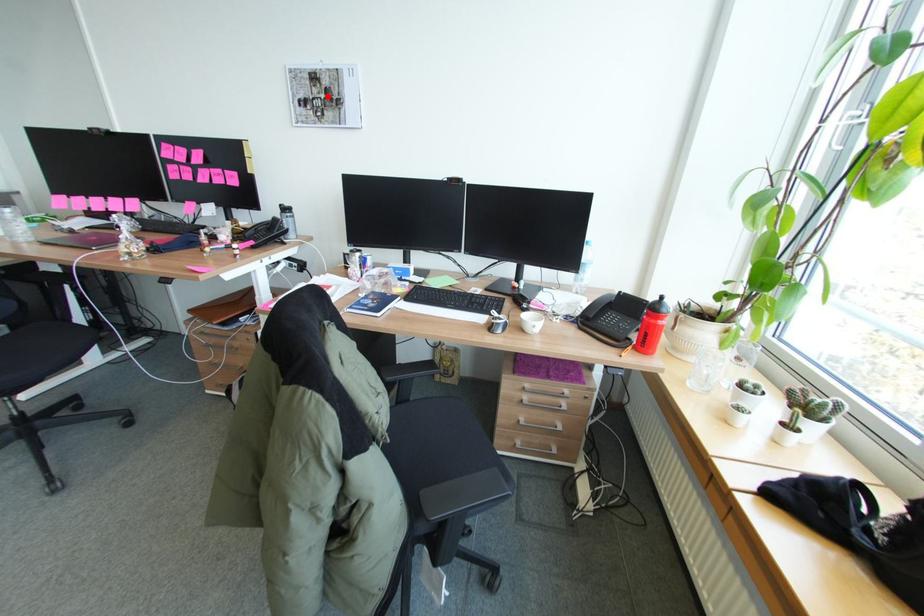
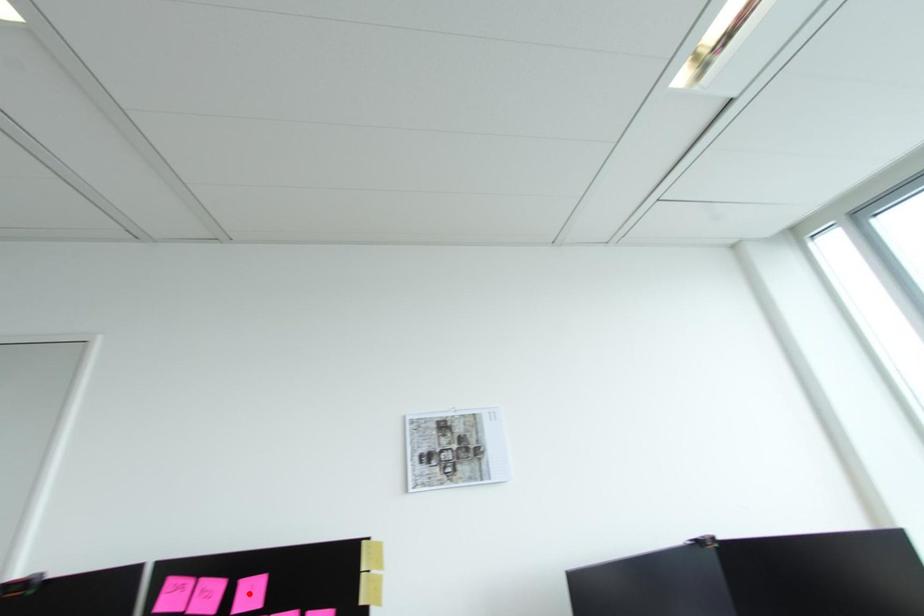
I am providing you with two images of the same scene from different viewpoints. A red point is marked on the first image and another point is marked on the second image. Does the point marked in image1 correspond to the same location as the one in image2?

No